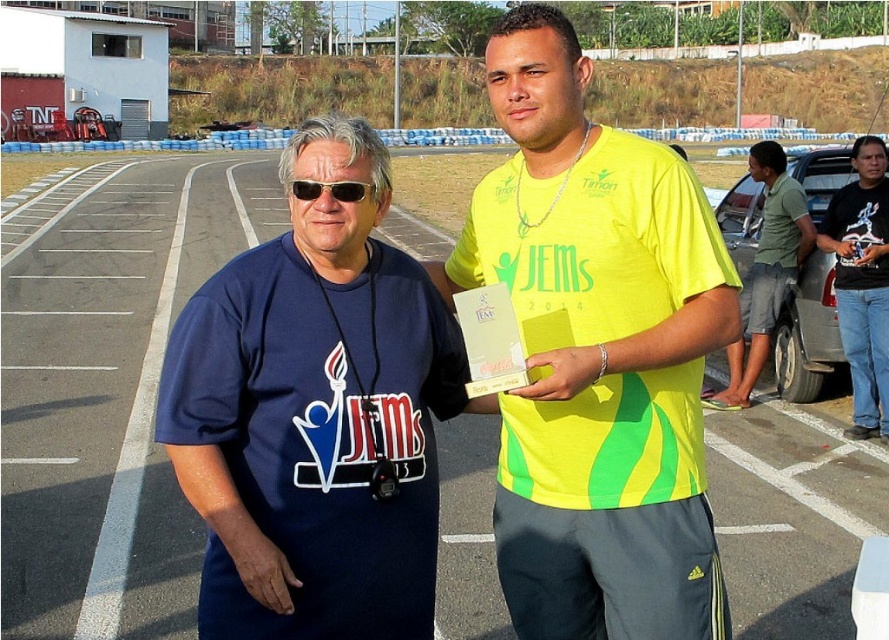
Question: Is yellow matte shirt at center positioned before blue fabric shirt at center?

Choices:
 (A) no
 (B) yes

Answer: (A)

Question: Which of the following is the farthest from the observer?

Choices:
 (A) blue fabric shirt at center
 (B) yellow matte shirt at center

Answer: (B)

Question: Which point is farther to the camera?

Choices:
 (A) (372, 188)
 (B) (593, 582)

Answer: (B)

Question: Which is nearer to the gray metallic car at right?

Choices:
 (A) blue fabric shirt at center
 (B) yellow matte shirt at center

Answer: (B)

Question: Is yellow matte shirt at center behind gray metallic car at right?

Choices:
 (A) no
 (B) yes

Answer: (A)

Question: Does yellow matte shirt at center come behind black cotton shirt at right?

Choices:
 (A) no
 (B) yes

Answer: (A)